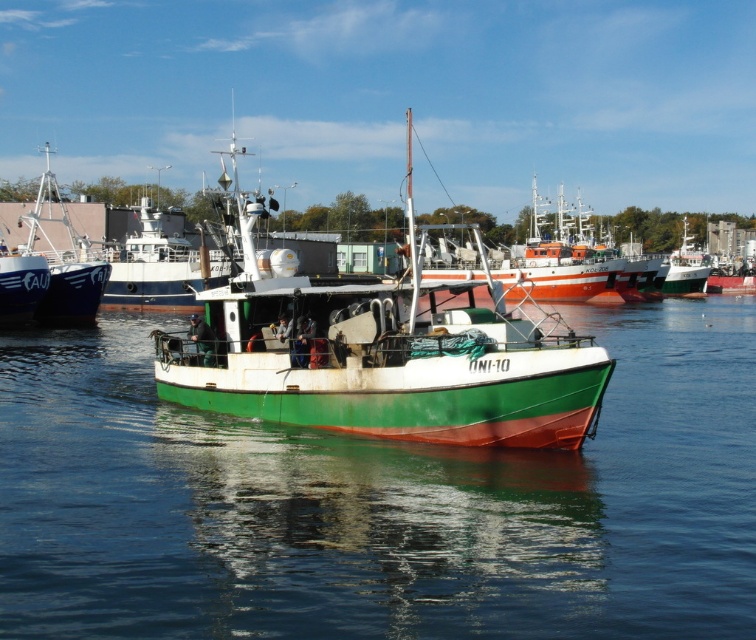
Is point (466, 234) closer to viewer compared to point (2, 292)?

No, (466, 234) is behind (2, 292).

Can you confirm if green painted wooden boat at center is shorter than white glossy boat at upper left?

Correct, green painted wooden boat at center is not as tall as white glossy boat at upper left.

Describe the element at coordinates (541, 262) in the screenshot. The width and height of the screenshot is (756, 640). I see `green painted wooden boat at center` at that location.

Where is `green painted wooden boat at center`? green painted wooden boat at center is located at coordinates (541, 262).

The height and width of the screenshot is (640, 756). What do you see at coordinates (380, 355) in the screenshot?
I see `green matte boat at center` at bounding box center [380, 355].

Image resolution: width=756 pixels, height=640 pixels. I want to click on green matte boat at center, so click(380, 355).

Who is taller, green matte boat at center or green painted wooden boat at center?

With more height is green matte boat at center.

The width and height of the screenshot is (756, 640). What are the coordinates of `green matte boat at center` in the screenshot? It's located at (380, 355).